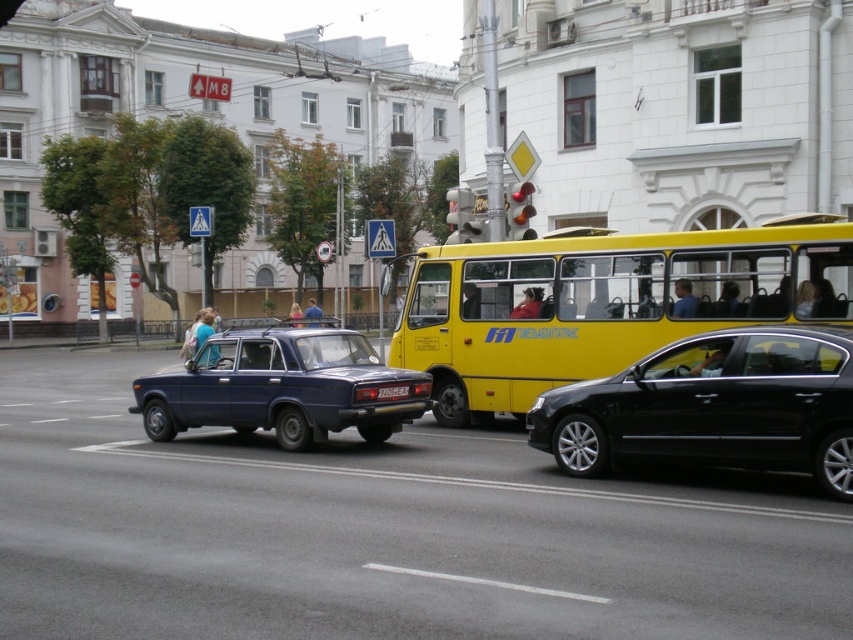
You are a delivery driver who needs to park your truck between the yellow matte bus at center and the black metallic car at center. Given that your truck is 5 meters long, can you fit it in the space between them?

The yellow matte bus at center is shorter than the black metallic car at center, but the description does not provide the exact distance between them. Therefore, it is impossible to determine if the 5 meter truck can fit between them.

You are a delivery driver who needs to park your vehicle in a parking spot that is exactly the same width as the black plastic license plate at center. Can your matte blue sedan at center fit into this parking spot?

The matte blue sedan at center is wider than the black plastic license plate at center, so it cannot fit into the parking spot designed for the license plate width.

You are a pedestrian standing at the crosswalk. You see a black metallic car at center and a matte blue sedan at center. Which vehicle is closer to the right side of the road?

The black metallic car at center is closer to the right side of the road because it is positioned to the right of the matte blue sedan at center.